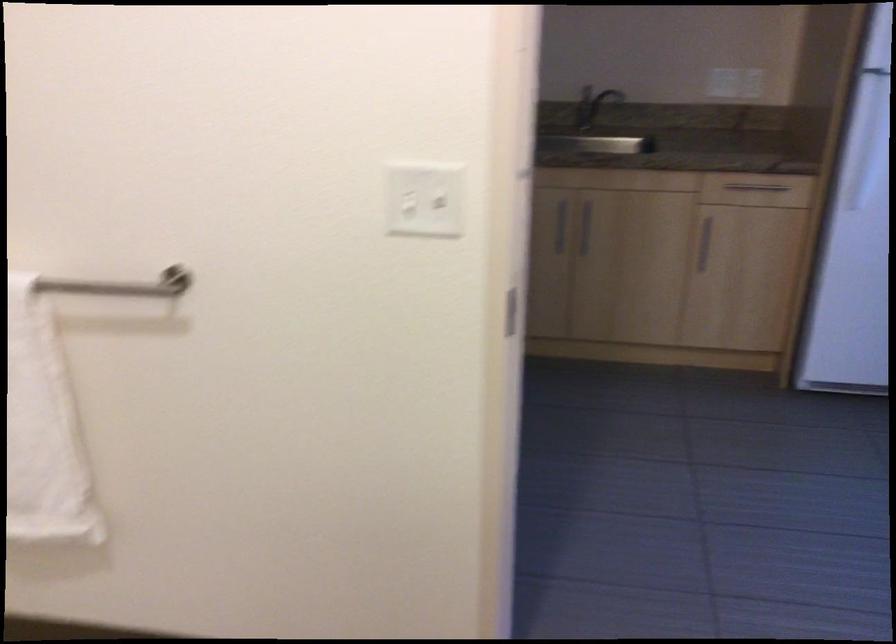
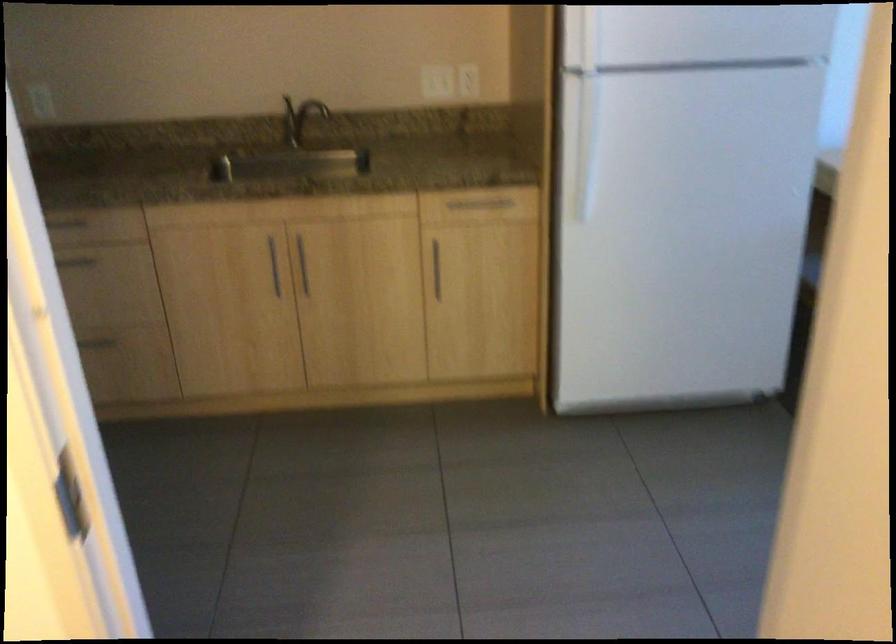
The point at [693,241] is marked in the first image. Where is the corresponding point in the second image?

(435, 269)